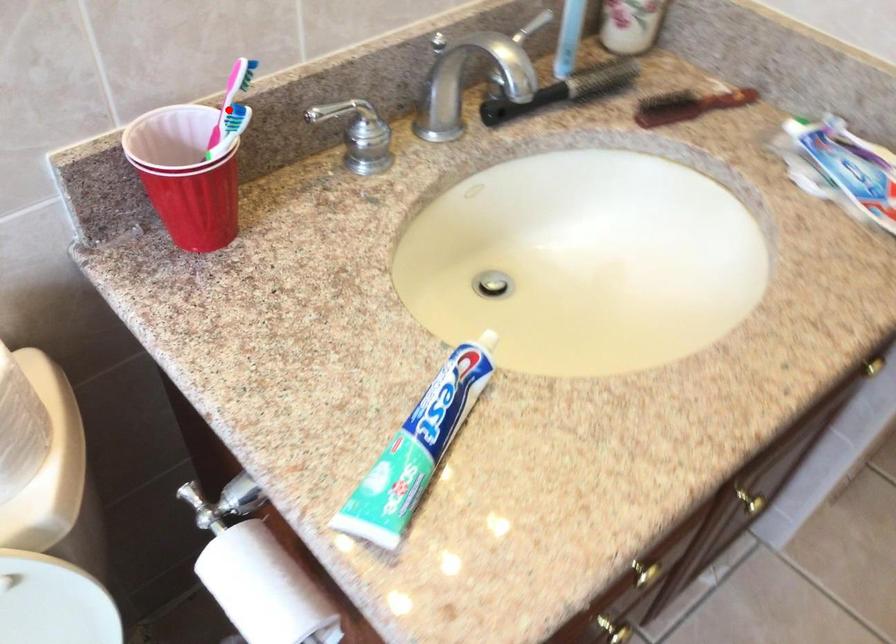
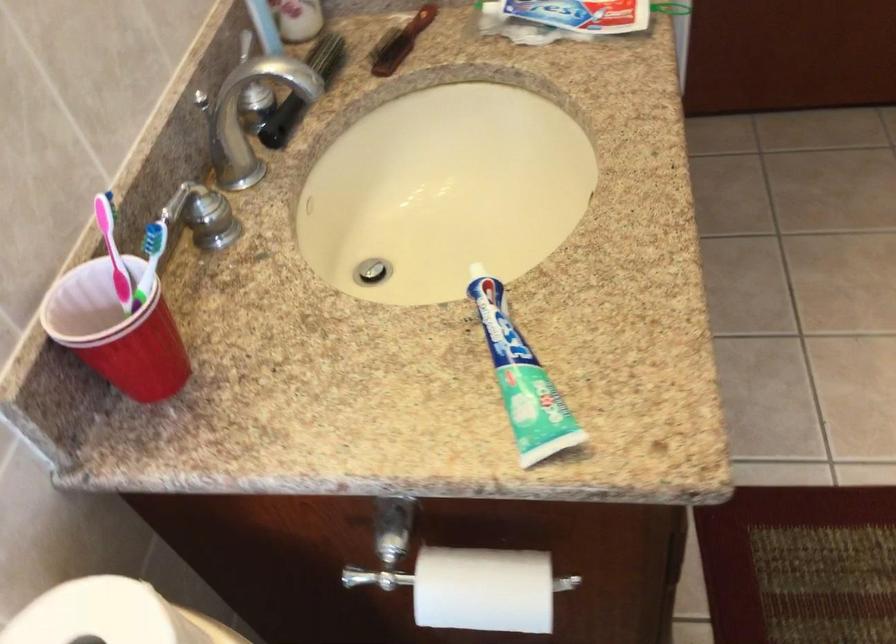
Find the pixel in the second image that matches the highlighted location in the first image.

(113, 251)